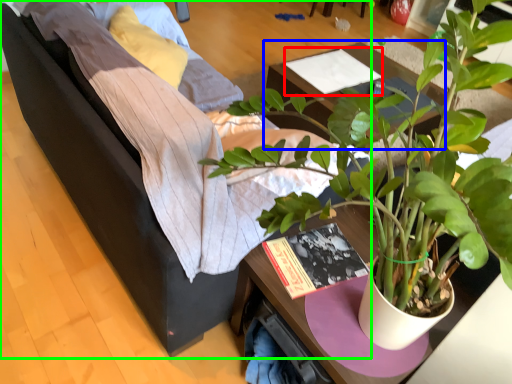
Question: Estimate the real-world distances between objects in this image. Which object is farther from magazine (highlighted by a red box), table (highlighted by a blue box) or studio couch (highlighted by a green box)?

Choices:
 (A) table
 (B) studio couch

Answer: (B)